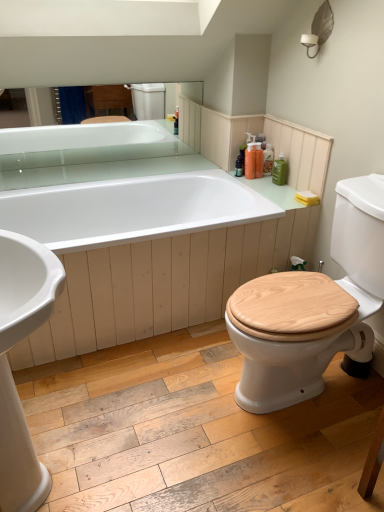
At what (x,y) coordinates should I click in order to perform the action: click on vacant area situated to the left side of translucent orange bottle at upper right, the third toiletry from the right. Please return your answer as a coordinate pair (x, y). Looking at the image, I should click on click(x=231, y=169).